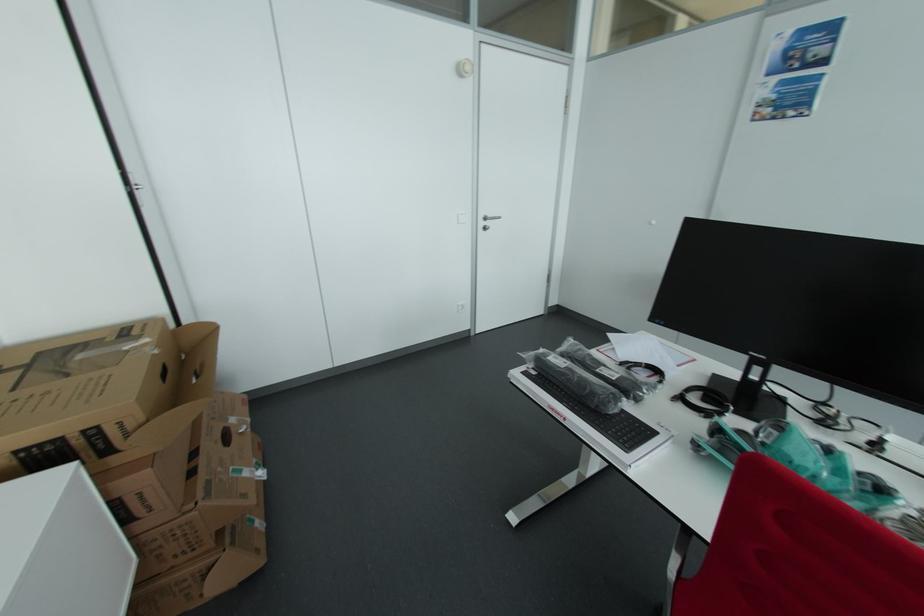
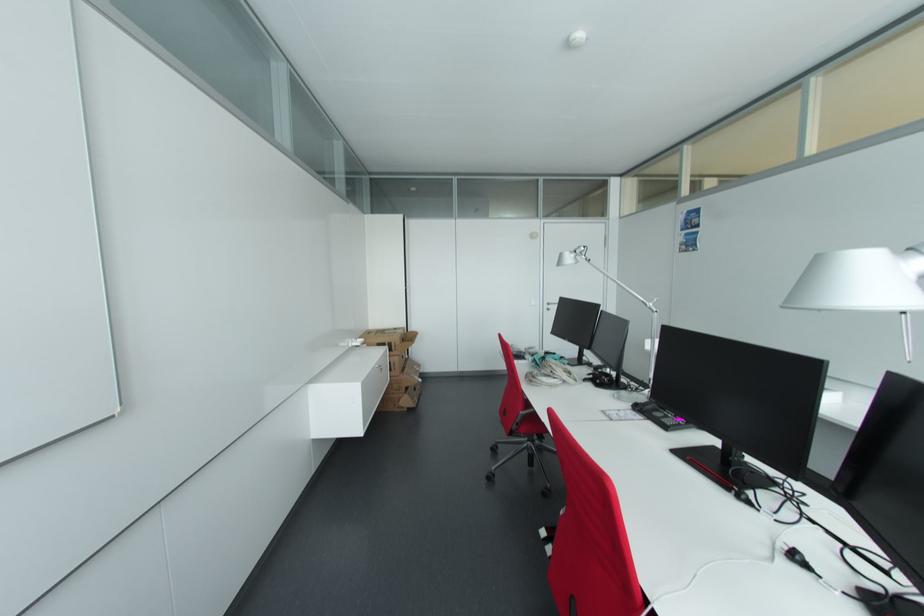
In the second image, find the point that corresponds to pixel 188 323 in the first image.

(412, 331)